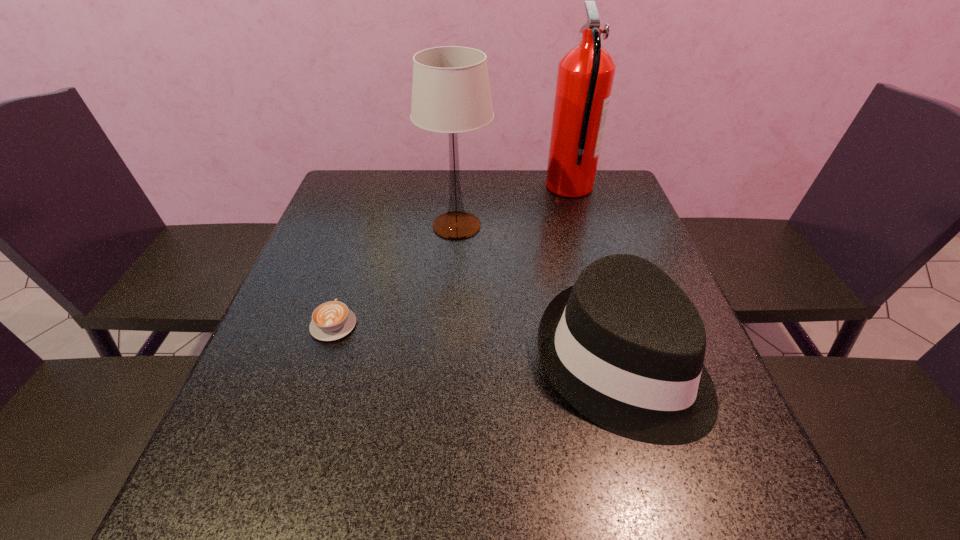
Where is `unoccupied position between the fedora and the table lamp`? Image resolution: width=960 pixels, height=540 pixels. unoccupied position between the fedora and the table lamp is located at coordinates coord(539,294).

Where is `vacant space in between the third object from right to left and the fedora`? This screenshot has width=960, height=540. vacant space in between the third object from right to left and the fedora is located at coordinates (539, 294).

This screenshot has height=540, width=960. What are the coordinates of `object that stands as the second closest to the farthest object` in the screenshot? It's located at point(625,346).

What are the coordinates of `object that is the third closest to the leftmost object` in the screenshot? It's located at (585, 76).

Find the location of a particular element. Image resolution: width=960 pixels, height=540 pixels. vacant point that satisfies the following two spatial constraints: 1. above the cylindrical shade of the third nearest object; 2. on the back side of the third tallest object is located at coordinates (447, 362).

The height and width of the screenshot is (540, 960). I want to click on vacant point that satisfies the following two spatial constraints: 1. on the back side of the fedora; 2. above the cylindrical shade of the second object from left to right, so click(581, 226).

What are the coordinates of `vacant point that satisfies the following two spatial constraints: 1. above the cylindrical shade of the third nearest object; 2. on the left side of the fedora` in the screenshot? It's located at (447, 362).